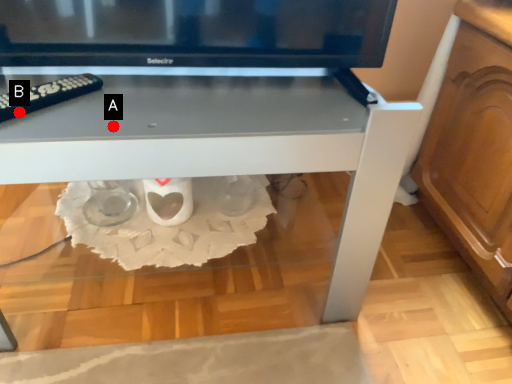
Question: Two points are circled on the image, labeled by A and B beside each circle. Which point is closer to the camera?

Choices:
 (A) A is closer
 (B) B is closer

Answer: (A)